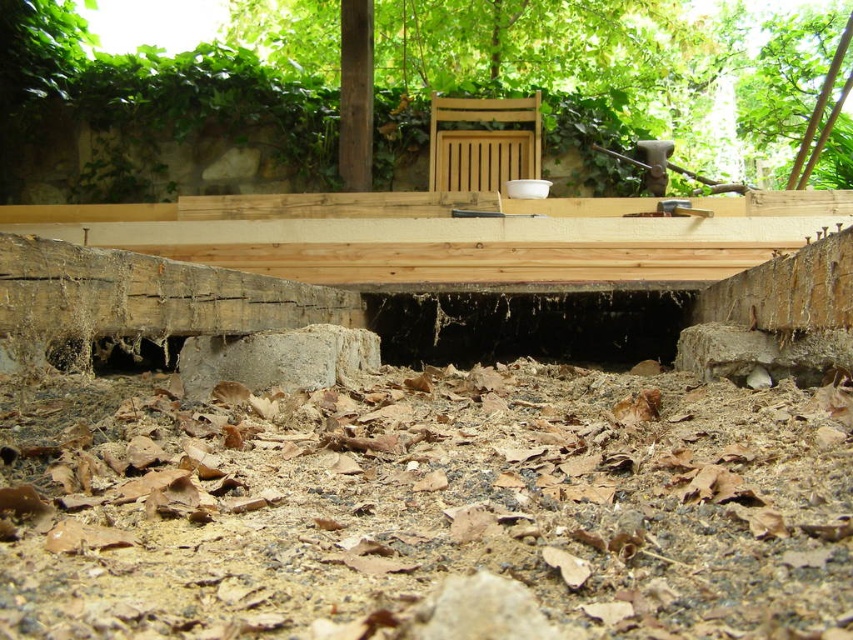
Does brown dirt at center lie behind wooden chair at center?

No, brown dirt at center is in front of wooden chair at center.

Is the position of brown dirt at center less distant than that of wooden chair at center?

Yes, brown dirt at center is in front of wooden chair at center.

Is point (456, 483) farther from camera compared to point (451, 140)?

No, (456, 483) is in front of (451, 140).

This screenshot has height=640, width=853. In order to click on brown dirt at center in this screenshot , I will do pyautogui.click(x=427, y=509).

Between brown dirt at center and natural wood deck at center, which one is positioned lower?

brown dirt at center is below.

Image resolution: width=853 pixels, height=640 pixels. Find the location of `brown dirt at center`. brown dirt at center is located at coordinates (427, 509).

Locate an element on the screen. Image resolution: width=853 pixels, height=640 pixels. brown dirt at center is located at coordinates (427, 509).

In the scene shown: Can you confirm if natural wood deck at center is shorter than wooden chair at center?

Yes, natural wood deck at center is shorter than wooden chair at center.

Is point (260, 204) more distant than point (485, 172)?

No, it is in front of (485, 172).

Which is in front, point (422, 225) or point (525, 170)?

Point (422, 225) is more forward.

Where is `natural wood deck at center`? The image size is (853, 640). natural wood deck at center is located at coordinates (450, 236).